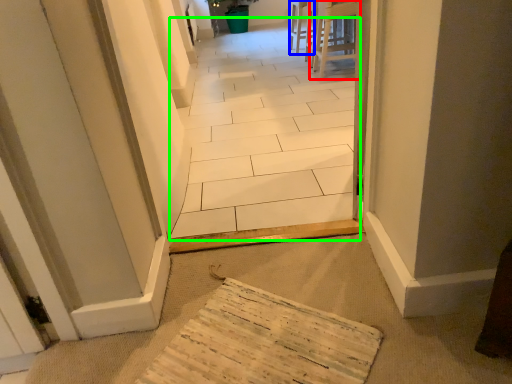
Question: Based on their relative distances, which object is farther from furniture (highlighted by a red box)? Choose from chair (highlighted by a blue box) and path (highlighted by a green box).

Choices:
 (A) chair
 (B) path

Answer: (B)